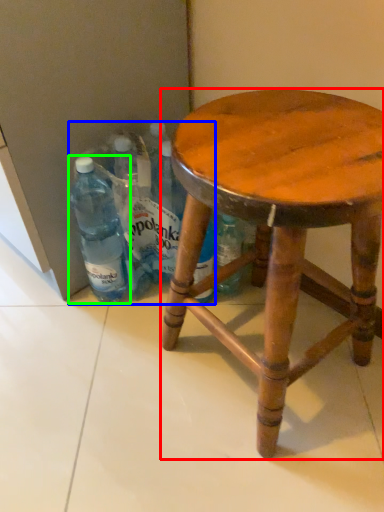
Question: Which is nearer to the stool (highlighted by a red box)? beverage (highlighted by a blue box) or bottle (highlighted by a green box).

Choices:
 (A) beverage
 (B) bottle

Answer: (A)